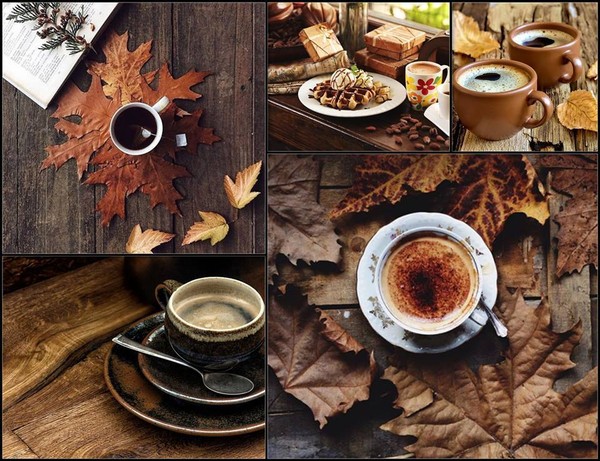
The image size is (600, 461). I want to click on cup handles, so click(x=577, y=67), click(x=549, y=107), click(x=161, y=103), click(x=160, y=288), click(x=480, y=319).